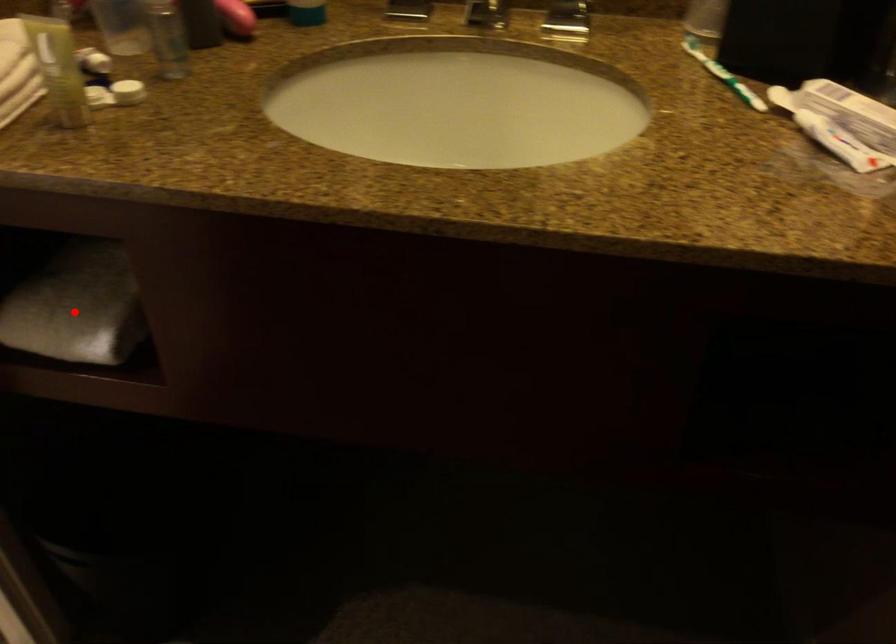
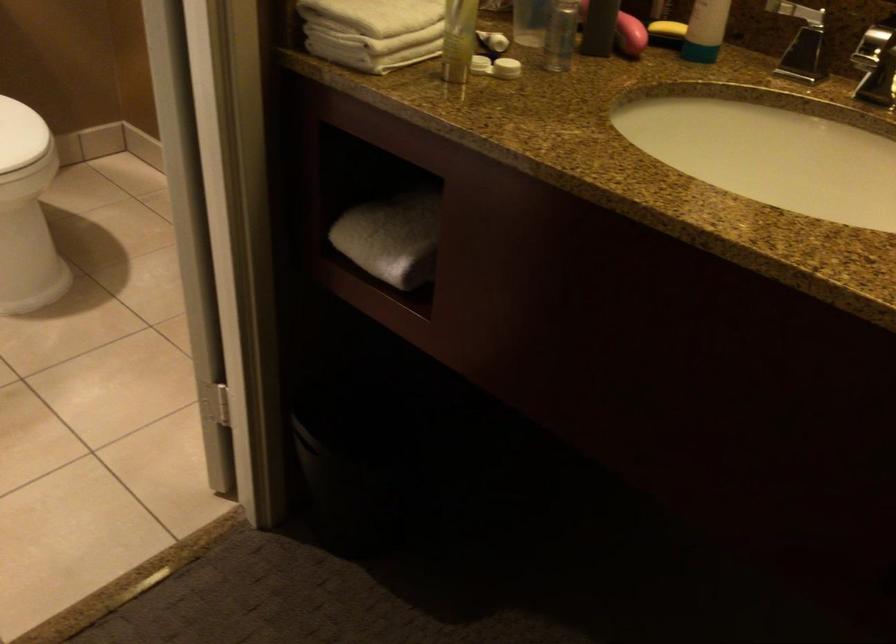
Question: I am providing you with two images of the same scene from different viewpoints. In image1, a red point is highlighted. Considering the same 3D point in image2, which of the following is correct?

Choices:
 (A) It is closer
 (B) It is farther

Answer: (B)